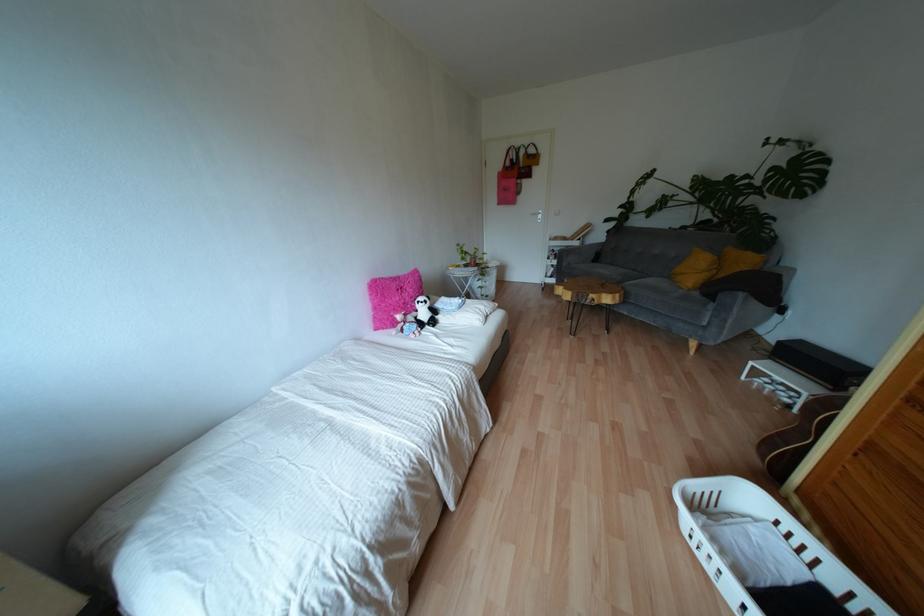
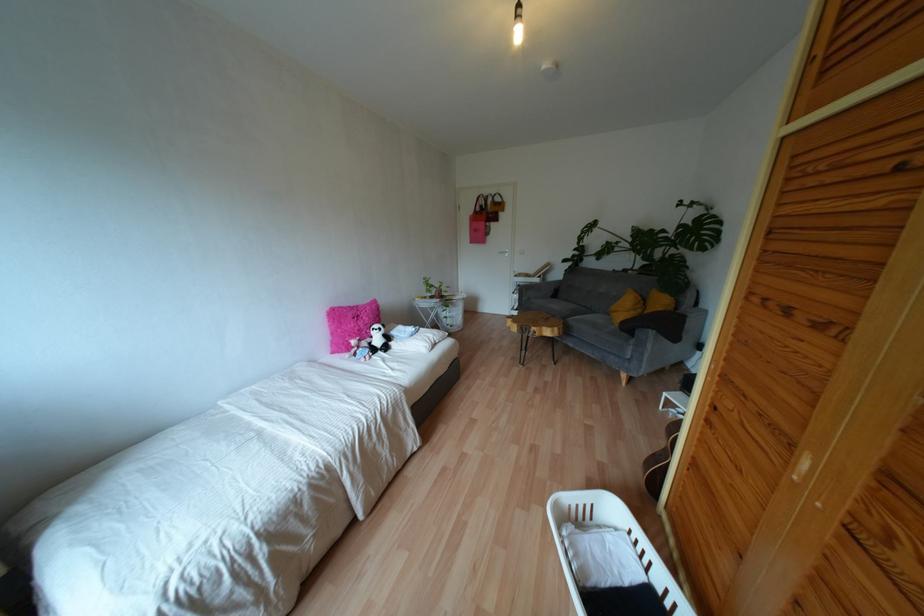
Where in the second image is the point corresponding to (695,269) from the first image?

(623, 308)